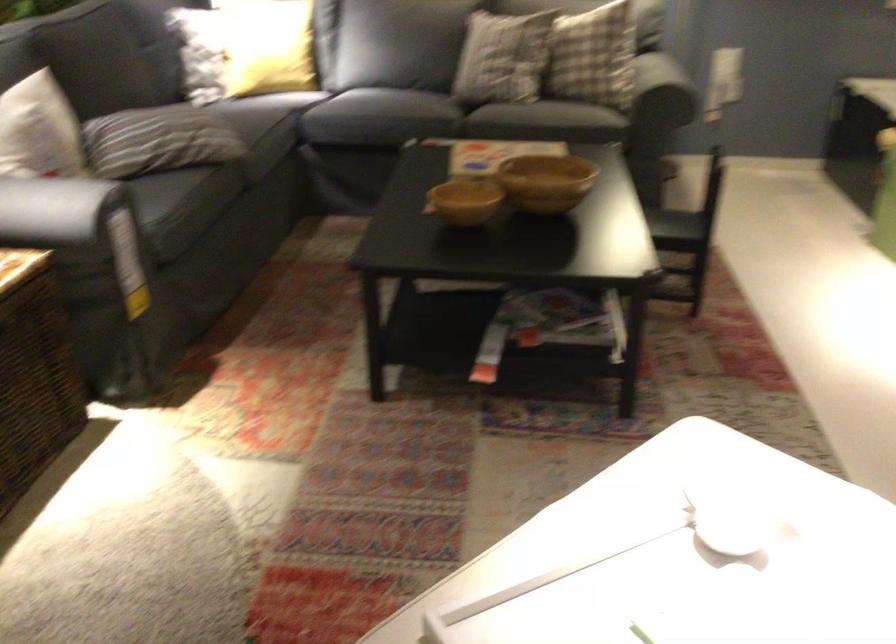
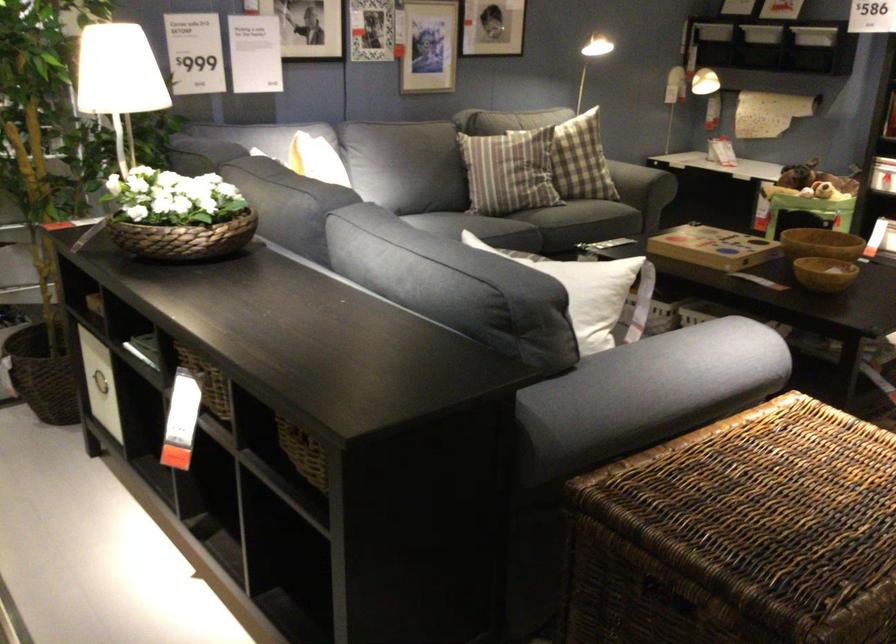
The point at (427, 198) is marked in the first image. Where is the corresponding point in the second image?

(823, 272)